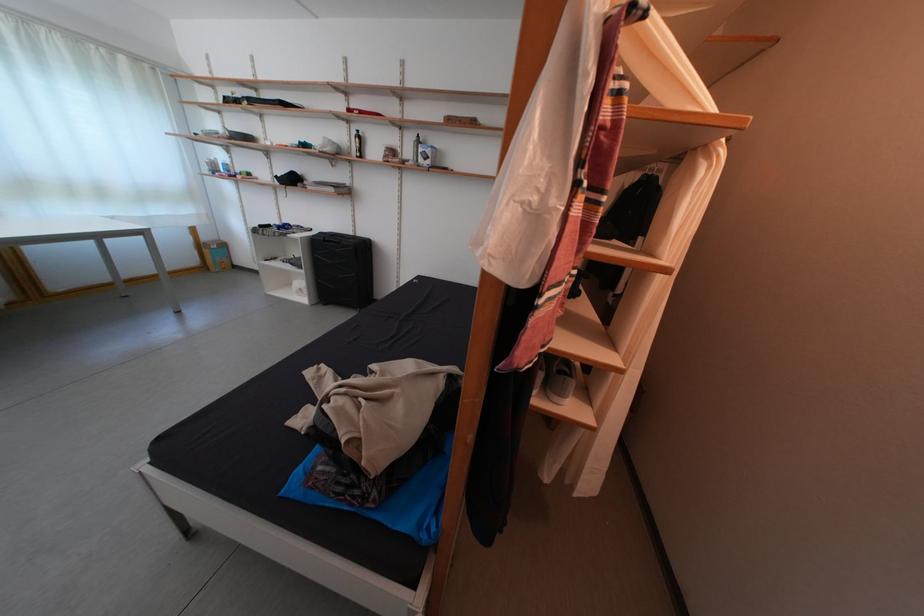
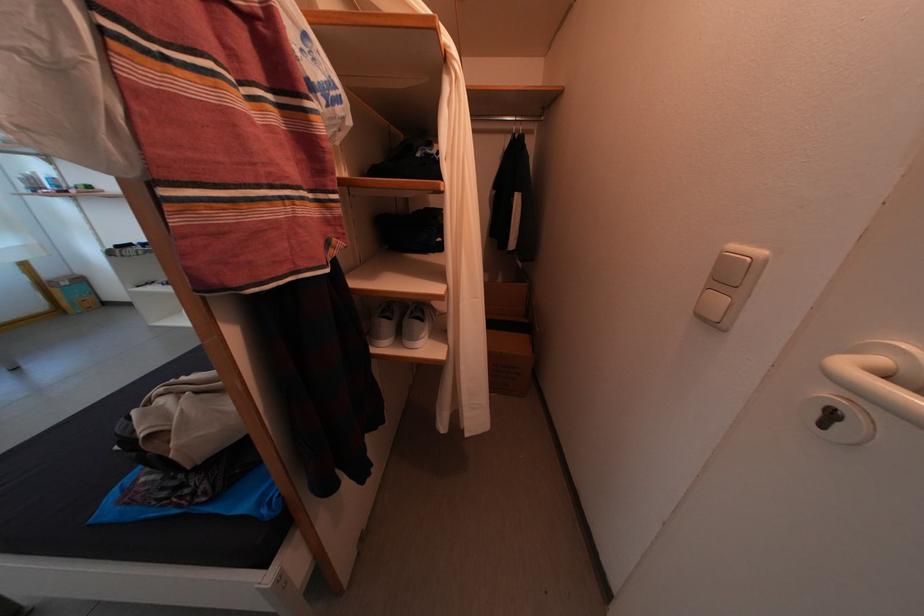
Locate, in the second image, the point that corresponds to (572,400) in the first image.

(423, 344)